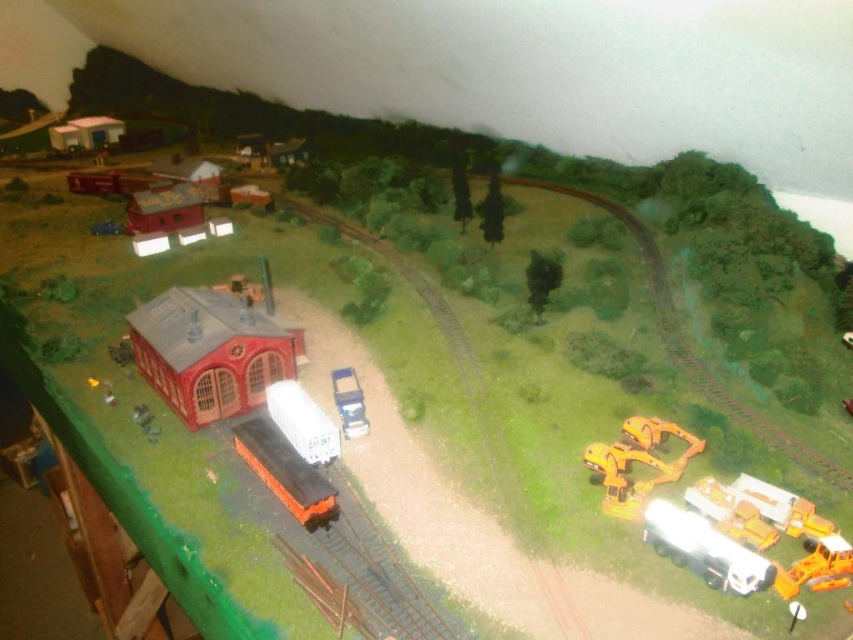
Question: Which object appears closest to the camera in this image?

Choices:
 (A) metallic blue truck at center
 (B) orange matte train car at center
 (C) metallic yellow excavator at lower right

Answer: (C)

Question: Can you confirm if yellow plastic excavator at lower right is wider than metallic yellow excavator at lower right?

Choices:
 (A) no
 (B) yes

Answer: (B)

Question: Estimate the real-world distances between objects in this image. Which object is closer to the metallic yellow excavator at lower right?

Choices:
 (A) metallic blue truck at center
 (B) orange matte train car at center
 (C) yellow plastic excavator at lower right

Answer: (C)

Question: Based on their relative distances, which object is farther from the orange matte train car at center?

Choices:
 (A) metallic blue truck at center
 (B) metallic yellow excavator at lower right
 (C) yellow plastic excavator at lower right

Answer: (B)

Question: Does orange matte train car at center have a lesser width compared to metallic yellow excavator at lower right?

Choices:
 (A) no
 (B) yes

Answer: (A)

Question: Is metallic yellow excavator at lower right wider than metallic blue truck at center?

Choices:
 (A) yes
 (B) no

Answer: (A)